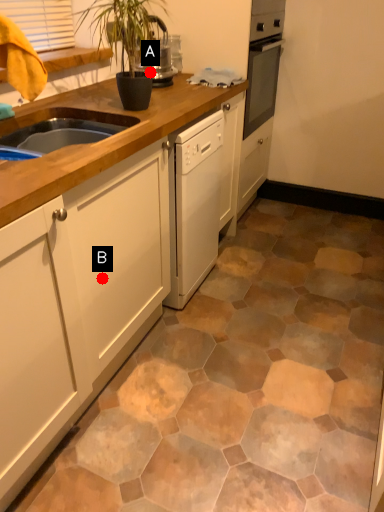
Question: Two points are circled on the image, labeled by A and B beside each circle. Which point is farther to the camera?

Choices:
 (A) A is further
 (B) B is further

Answer: (A)